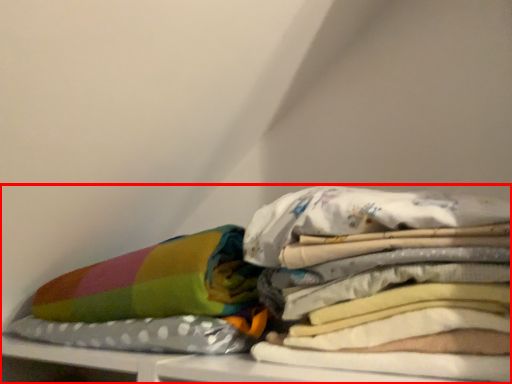
Question: From the image's perspective, where is furniture (annotated by the red box) located in relation to material in the image?

Choices:
 (A) above
 (B) below

Answer: (A)